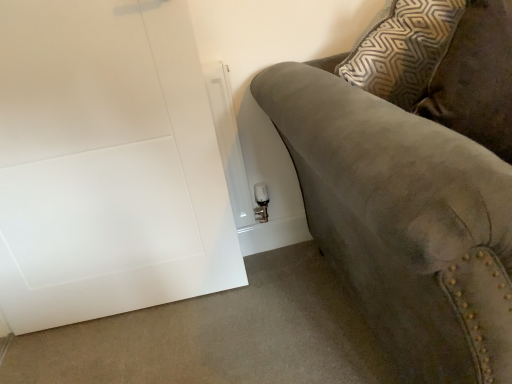
Question: From the image's perspective, is white matte door at lower left located above or below suede couch at right?

Choices:
 (A) above
 (B) below

Answer: (A)

Question: Is white matte door at lower left to the left or to the right of suede couch at right in the image?

Choices:
 (A) right
 (B) left

Answer: (B)

Question: Would you say white matte door at lower left is inside or outside suede couch at right?

Choices:
 (A) outside
 (B) inside

Answer: (A)

Question: Based on their positions, is suede couch at right located to the left or right of white matte door at lower left?

Choices:
 (A) right
 (B) left

Answer: (A)

Question: Considering the positions of suede couch at right and white matte door at lower left in the image, is suede couch at right taller or shorter than white matte door at lower left?

Choices:
 (A) short
 (B) tall

Answer: (A)

Question: From the image's perspective, relative to white matte door at lower left, is suede couch at right above or below?

Choices:
 (A) below
 (B) above

Answer: (A)

Question: Considering their positions, is suede couch at right located in front of or behind white matte door at lower left?

Choices:
 (A) behind
 (B) front

Answer: (B)